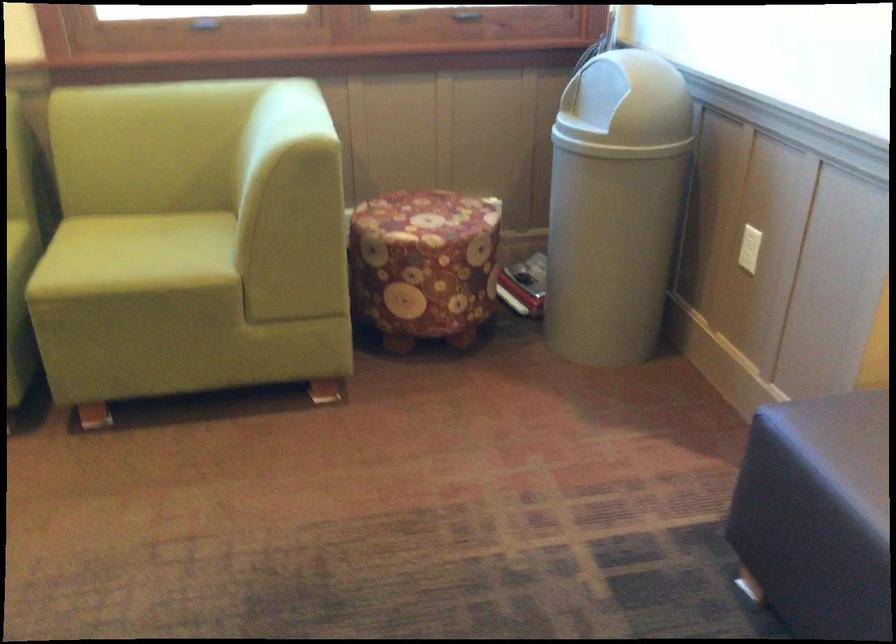
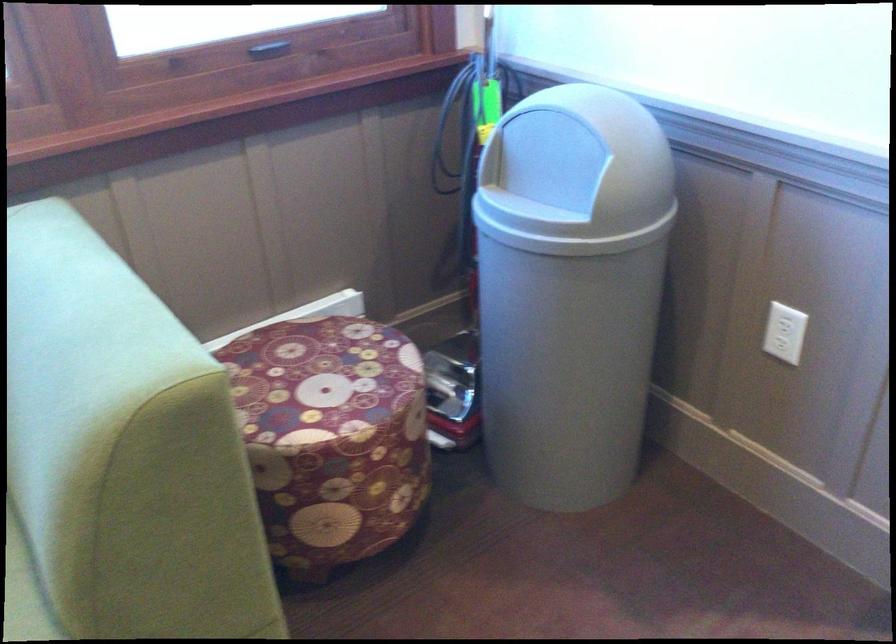
In the second image, find the point that corresponds to (751,243) in the first image.

(787, 328)